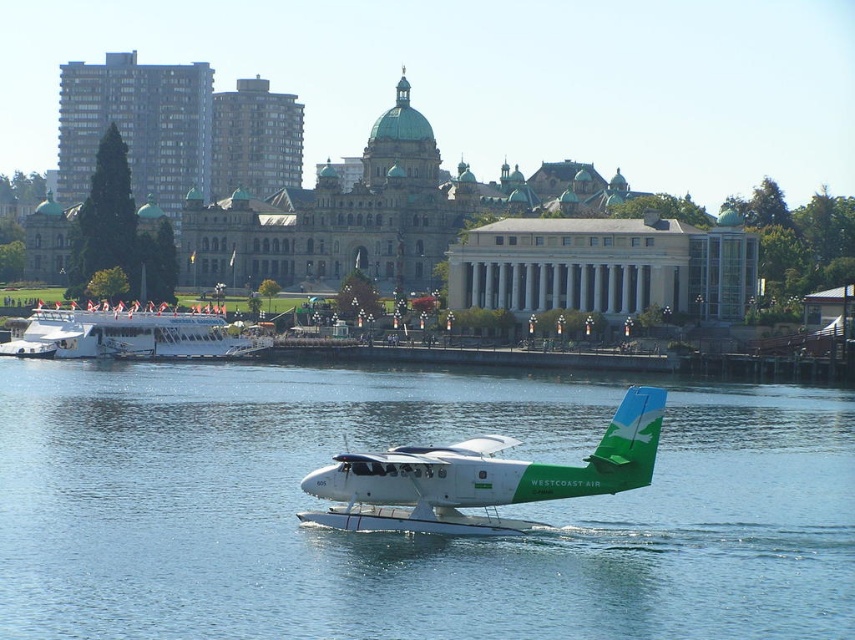
Which of these two, white glossy seaplane at center or white glossy boat at left, stands shorter?

white glossy boat at left

Is white glossy seaplane at center positioned in front of white glossy boat at left?

Yes, white glossy seaplane at center is closer to the viewer.

Locate an element on the screen. This screenshot has height=640, width=855. white glossy seaplane at center is located at coordinates (481, 477).

This screenshot has width=855, height=640. What do you see at coordinates (407, 536) in the screenshot?
I see `blue water at center` at bounding box center [407, 536].

Does blue water at center have a larger size compared to white glossy seaplane at center?

Correct, blue water at center is larger in size than white glossy seaplane at center.

Find the location of a particular element. blue water at center is located at coordinates (407, 536).

The width and height of the screenshot is (855, 640). I want to click on blue water at center, so click(407, 536).

Can you confirm if blue water at center is taller than white glossy boat at left?

Yes, blue water at center is taller than white glossy boat at left.

Does blue water at center come behind white glossy boat at left?

No, blue water at center is in front of white glossy boat at left.

Which is behind, point (3, 552) or point (214, 339)?

Point (214, 339)

At what (x,y) coordinates should I click in order to perform the action: click on blue water at center. Please return your answer as a coordinate pair (x, y). The width and height of the screenshot is (855, 640). Looking at the image, I should click on (407, 536).